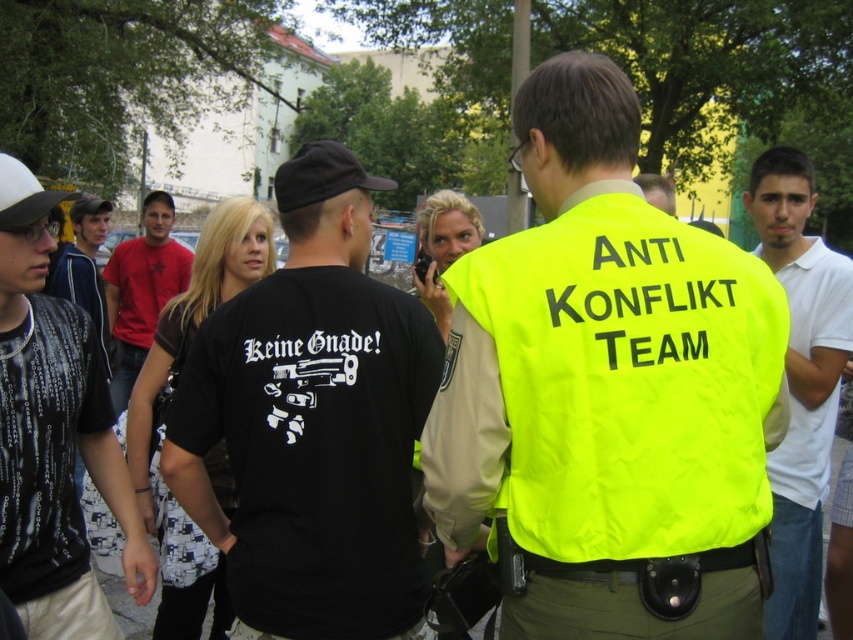
Question: Can you confirm if white cotton shirt at right is positioned below matte red t-shirt at center?

Choices:
 (A) yes
 (B) no

Answer: (A)

Question: Is black matte t-shirt at center to the left of black textured shirt at left from the viewer's perspective?

Choices:
 (A) no
 (B) yes

Answer: (A)

Question: From the image, what is the correct spatial relationship of white cotton shirt at right in relation to light brown hair at center?

Choices:
 (A) above
 (B) below

Answer: (B)

Question: Which point is closer to the camera?

Choices:
 (A) black printed shirt at left
 (B) white cotton shirt at right
 (C) black textured shirt at left
 (D) black matte t-shirt at center

Answer: (D)

Question: Which object appears farthest from the camera in this image?

Choices:
 (A) light brown hair at center
 (B) black textured shirt at left
 (C) white cotton shirt at right
 (D) black matte t-shirt at center

Answer: (B)

Question: Among these objects, which one is nearest to the camera?

Choices:
 (A) black matte t-shirt at center
 (B) black textured shirt at left
 (C) matte red t-shirt at center

Answer: (A)